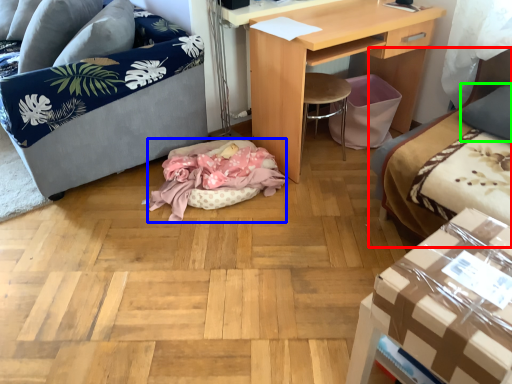
Question: Considering the real-world distances, which object is farthest from studio couch (highlighted by a red box)? cat bed (highlighted by a blue box) or pillow (highlighted by a green box)?

Choices:
 (A) cat bed
 (B) pillow

Answer: (A)